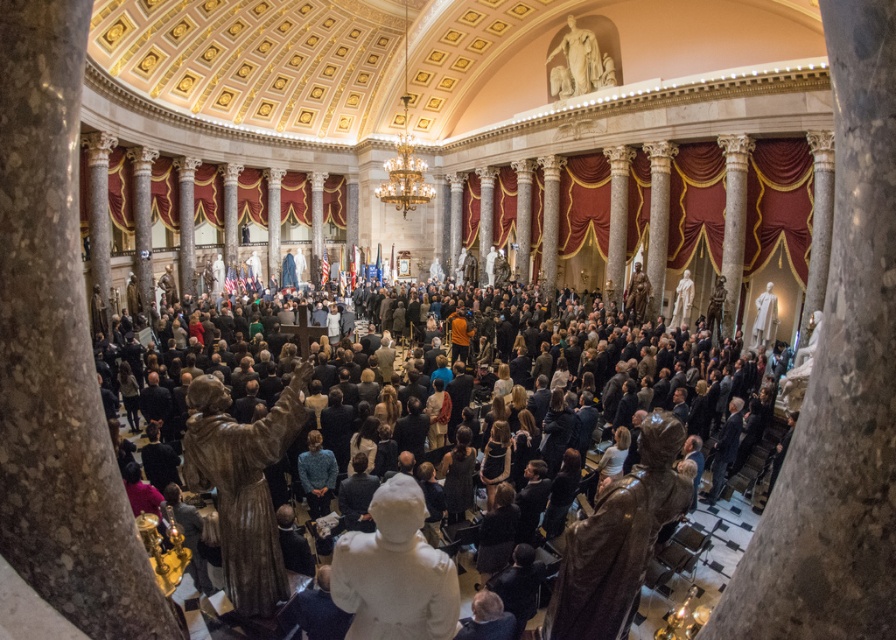
Who is lower down, brown statue at center or white marble statue at upper center?

brown statue at center

Does brown statue at center appear on the left side of white marble statue at upper center?

Correct, you'll find brown statue at center to the left of white marble statue at upper center.

Identify the location of brown statue at center. This screenshot has width=896, height=640. (242, 484).

Can you confirm if bronze statue at center is shorter than brown statue at center?

Yes.

Can you confirm if bronze statue at center is thinner than brown statue at center?

No.

Is point (560, 636) behind point (240, 480)?

That is False.

This screenshot has width=896, height=640. Identify the location of bronze statue at center. (618, 540).

Can you confirm if bronze statue at center is positioned to the right of white marble statue at center?

Indeed, bronze statue at center is positioned on the right side of white marble statue at center.

In the scene shown: Can you confirm if bronze statue at center is shorter than white marble statue at center?

In fact, bronze statue at center may be taller than white marble statue at center.

Locate an element on the screen. bronze statue at center is located at coordinates (618, 540).